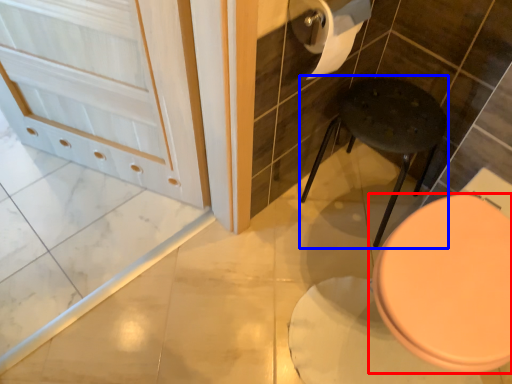
Question: Which of the following is the farthest to the observer, toilet (highlighted by a red box) or bar stool (highlighted by a blue box)?

Choices:
 (A) toilet
 (B) bar stool

Answer: (B)